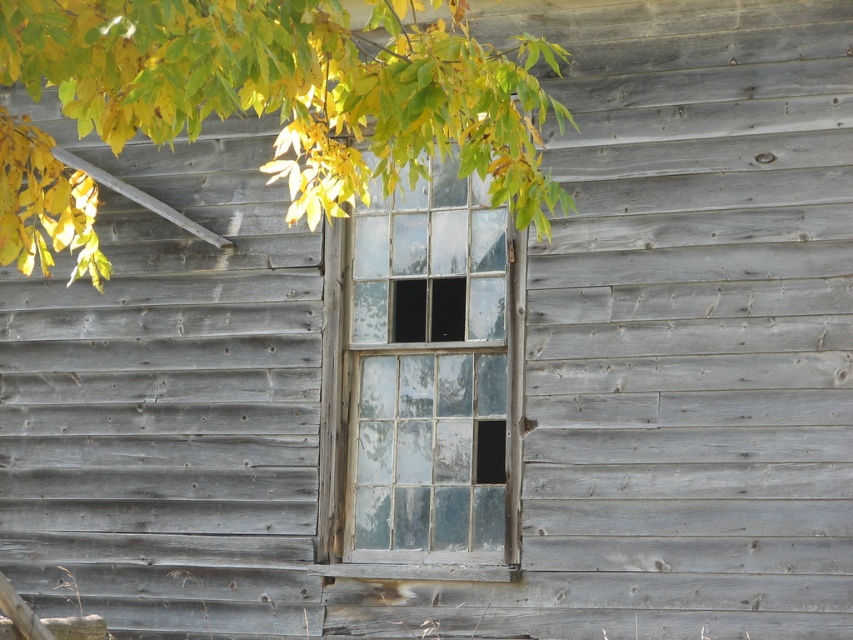
Question: Is yellow-green leaves at upper left thinner than clear glass window at center?

Choices:
 (A) no
 (B) yes

Answer: (A)

Question: Which of the following is the farthest from the observer?

Choices:
 (A) (442, 330)
 (B) (404, 104)

Answer: (A)

Question: Which object is closer to the camera taking this photo?

Choices:
 (A) yellow-green leaves at upper left
 (B) clear glass window at center

Answer: (A)

Question: Does yellow-green leaves at upper left have a smaller size compared to clear glass window at center?

Choices:
 (A) yes
 (B) no

Answer: (B)

Question: Does yellow-green leaves at upper left appear on the right side of clear glass window at center?

Choices:
 (A) no
 (B) yes

Answer: (A)

Question: Which point is closer to the camera?

Choices:
 (A) clear glass window at center
 (B) yellow-green leaves at upper left

Answer: (B)